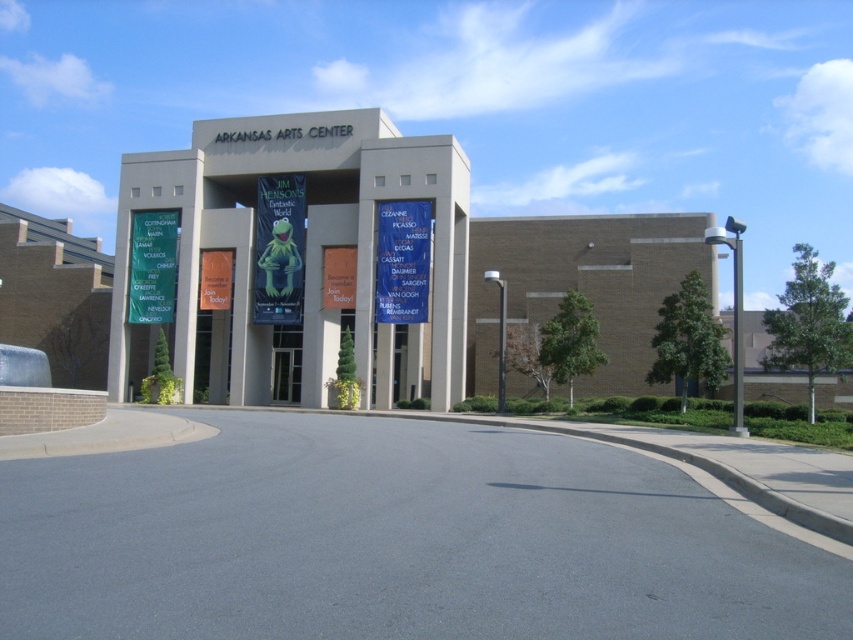
Which of these two, blue glass sign at center or orange fabric banner at center, stands taller?

blue glass sign at center

Does point (421, 314) come closer to viewer compared to point (335, 307)?

That is True.

Locate an element on the screen. blue glass sign at center is located at coordinates (402, 260).

Image resolution: width=853 pixels, height=640 pixels. Identify the location of green matte kermit at center. (279, 250).

The height and width of the screenshot is (640, 853). Describe the element at coordinates (279, 250) in the screenshot. I see `green matte kermit at center` at that location.

Where is `green matte kermit at center`? green matte kermit at center is located at coordinates (279, 250).

Does green fabric sign at left have a greater width compared to matte green banner at center?

Indeed, green fabric sign at left has a greater width compared to matte green banner at center.

Locate an element on the screen. The width and height of the screenshot is (853, 640). green fabric sign at left is located at coordinates (152, 266).

Locate an element on the screen. Image resolution: width=853 pixels, height=640 pixels. green fabric sign at left is located at coordinates (152, 266).